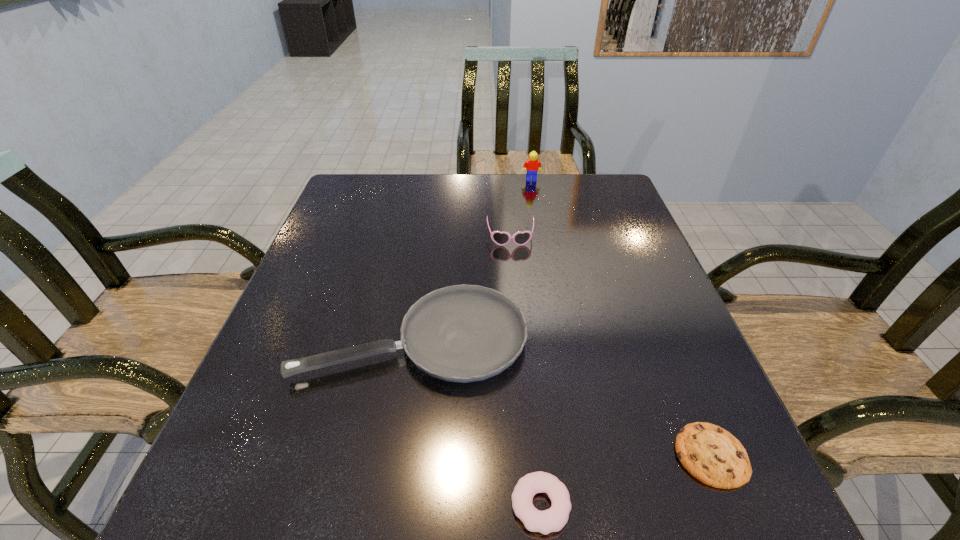
Where is `free space at the left edge of the desktop`? free space at the left edge of the desktop is located at coordinates (280, 342).

Locate an element on the screen. This screenshot has width=960, height=540. vacant space at the right edge is located at coordinates (612, 278).

In the image, there is a desktop. Identify the location of vacant space at the far left corner. (328, 214).

You are a GUI agent. You are given a task and a screenshot of the screen. Output one action in this format:
    pyautogui.click(x=<x>, y=<y>)
    Task: Click on the vacant space at the near left corner of the desktop
    Image resolution: width=960 pixels, height=540 pixels.
    Given the screenshot: What is the action you would take?
    pyautogui.click(x=279, y=512)

Image resolution: width=960 pixels, height=540 pixels. I want to click on vacant position at the far right corner of the desktop, so click(601, 181).

Locate an element on the screen. Image resolution: width=960 pixels, height=540 pixels. empty space between the tallest object and the third farthest object is located at coordinates (472, 259).

At what (x,y) coordinates should I click in order to perform the action: click on vacant area between the third shortest object and the tallest object. Please return your answer as a coordinate pair (x, y). The height and width of the screenshot is (540, 960). Looking at the image, I should click on (472, 259).

Find the location of a particular element. Image resolution: width=960 pixels, height=540 pixels. free space between the third tallest object and the Lego is located at coordinates (472, 259).

Identify the location of unoccupied area between the sunglasses and the farthest object. (521, 209).

Identify the location of free spot between the third shortest object and the rightmost object. The width and height of the screenshot is (960, 540). (563, 397).